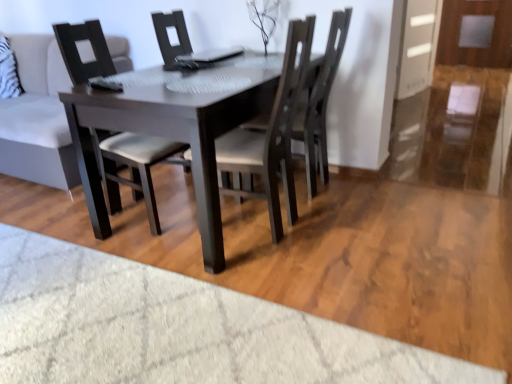
Where is `vacant area to the left of matte black chair at center, the 3th chair in the right-to-left sequence`? This screenshot has width=512, height=384. vacant area to the left of matte black chair at center, the 3th chair in the right-to-left sequence is located at coordinates (47, 230).